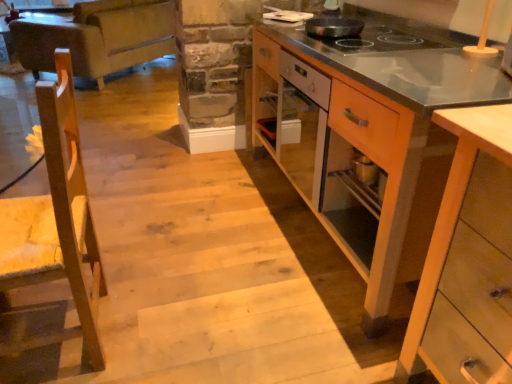
In order to click on vacant region to the left of wooden cabinet at right, the first cabinetry viewed from the back in this screenshot , I will do [x=188, y=210].